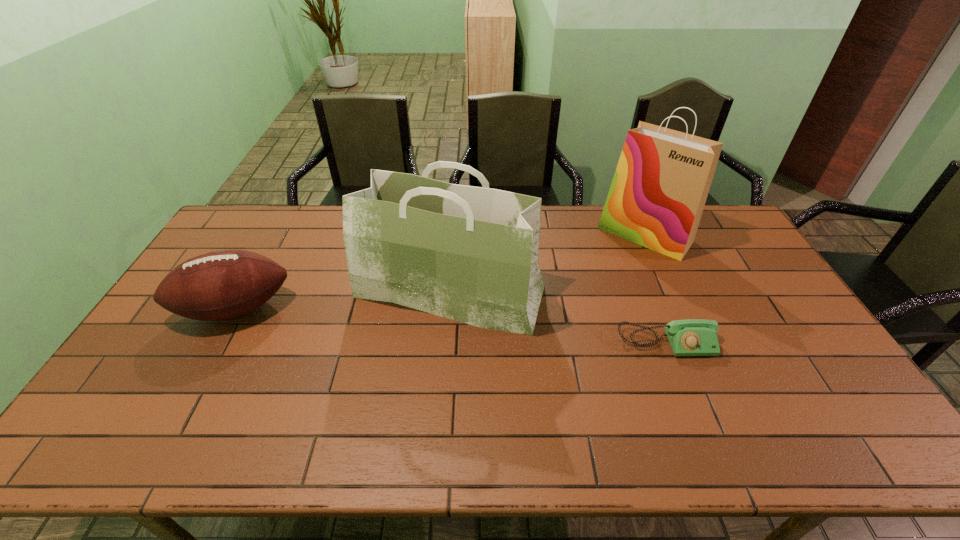
Where is `blank space that satisfies the following two spatial constraints: 1. on the back side of the third tallest object; 2. on the left side of the second object from left to right`? blank space that satisfies the following two spatial constraints: 1. on the back side of the third tallest object; 2. on the left side of the second object from left to right is located at coordinates (246, 290).

Locate an element on the screen. The image size is (960, 540). free spot that satisfies the following two spatial constraints: 1. on the back side of the second object from left to right; 2. on the left side of the second shortest object is located at coordinates (246, 290).